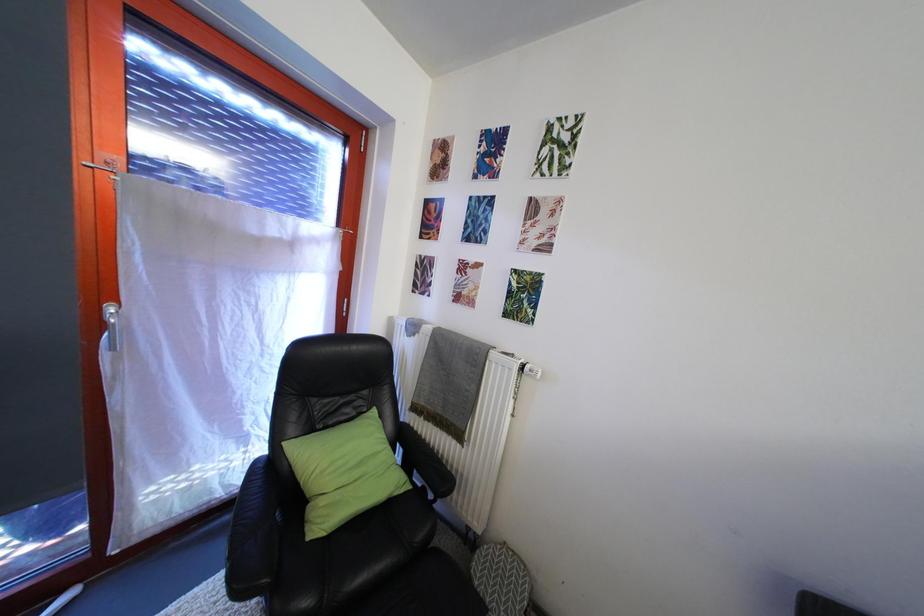
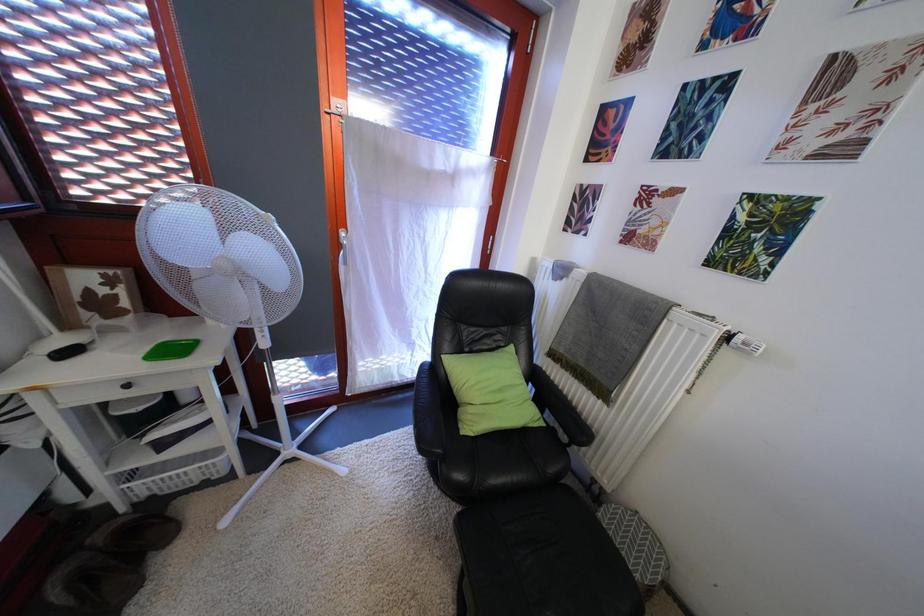
Question: The camera is either moving clockwise (left) or counter-clockwise (right) around the object. The first image is from the beginning of the video and the second image is from the end. Is the camera moving left or right when shooting the video?

Choices:
 (A) Left
 (B) Right

Answer: (B)